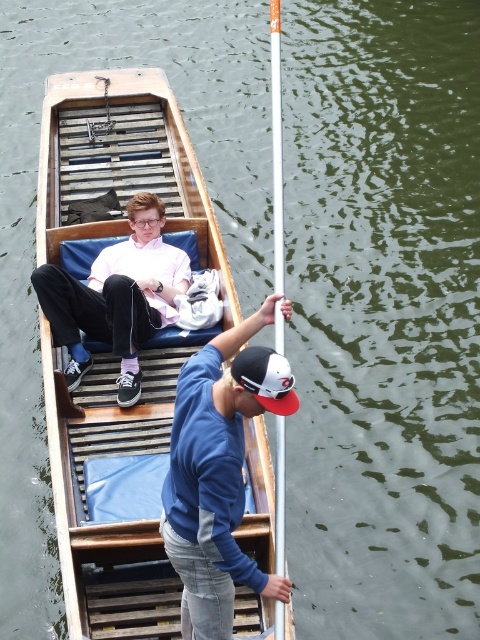
Consider the image. Is blue cotton shirt at center taller than white matte baseball cap at center?

Correct, blue cotton shirt at center is much taller as white matte baseball cap at center.

Does point (182, 433) lie behind point (257, 369)?

Yes, point (182, 433) is behind point (257, 369).

Who is more forward, [188,573] or [252,349]?

Point [252,349]

You are a GUI agent. You are given a task and a screenshot of the screen. Output one action in this format:
    pyautogui.click(x=<x>, y=<y>)
    Task: Click on the blue cotton shirt at center
    
    Given the screenshot: What is the action you would take?
    pyautogui.click(x=217, y=474)

Which is more to the right, blue cotton shirt at center or silver metallic pole at center?

Positioned to the right is silver metallic pole at center.

Image resolution: width=480 pixels, height=640 pixels. What do you see at coordinates (217, 474) in the screenshot? I see `blue cotton shirt at center` at bounding box center [217, 474].

The height and width of the screenshot is (640, 480). I want to click on blue cotton shirt at center, so click(217, 474).

Is point (81, 316) positioned behind point (273, 58)?

No, it is not.

Can you confirm if matte pink shirt at center is wider than silver metallic pole at center?

Yes, matte pink shirt at center is wider than silver metallic pole at center.

Is point (55, 289) farther from camera compared to point (279, 449)?

That is True.

What are the coordinates of `matte pink shirt at center` in the screenshot? It's located at (117, 296).